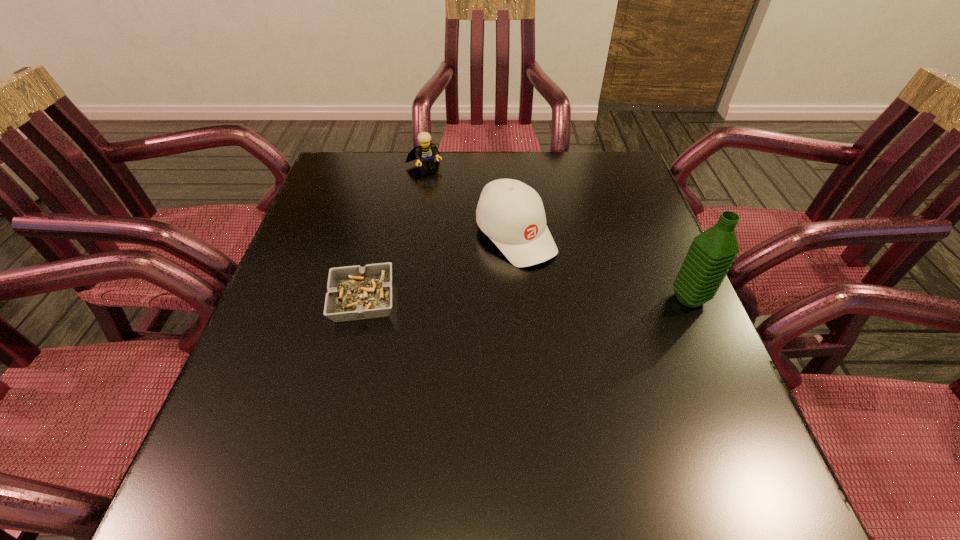
The height and width of the screenshot is (540, 960). I want to click on free spot on the desktop that is between the shortest object and the water bottle and is positioned on the front-facing side of the second object from right to left, so click(x=574, y=299).

You are a GUI agent. You are given a task and a screenshot of the screen. Output one action in this format:
    pyautogui.click(x=<x>, y=<y>)
    Task: Click on the vacant space on the desktop that is between the shortest object and the tallest object and is positioned on the front-facing side of the Lego
    The width and height of the screenshot is (960, 540).
    Given the screenshot: What is the action you would take?
    pyautogui.click(x=530, y=299)